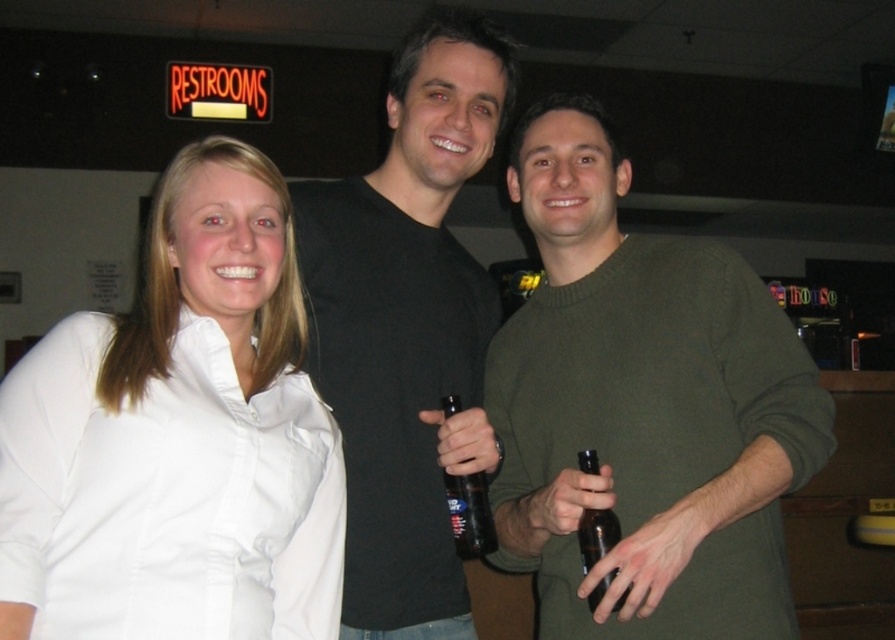
You are at a party and want to hand a drink to both the white smooth shirt at left and the black matte shirt at center. Based on their positions, which one would require you to reach lower to give the drink?

The white smooth shirt at left is located below the black matte shirt at center, so you would need to reach lower to give the drink to the white smooth shirt at left.

You are a photographer trying to capture a clear shot of the green matte sweater at center and the brown glass bottle at center. Since the camera can only focus on one object at a time, which object should you focus on to ensure it appears sharp in the photo?

The green matte sweater at center is much taller than the brown glass bottle at center, so focusing on the sweater would ensure it appears sharp since it occupies more of the frame.

You are standing in the scene and want to move from the point closer to you to the point further away. Which path should you take? The points are at coordinates point [710,291] and point [612,541]. Please describe the direction you need to move in terms of left, right, forward, or backward.

To move from the closer point to the further one, you should move backward because point [710,291] is closer to you and point [612,541] is further away.